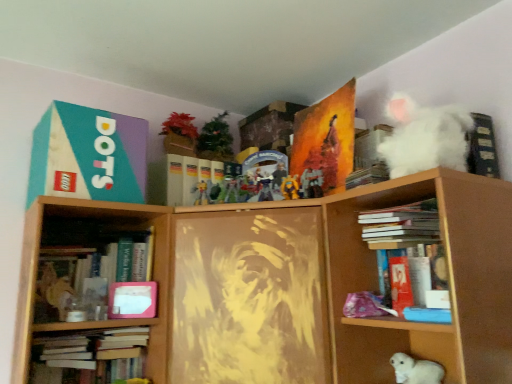
How much space does orange matte painting at upper center, acting as the second paperback book starting from the left, occupy horizontally?

8.38 centimeters.

The image size is (512, 384). Describe the element at coordinates (202, 194) in the screenshot. I see `matte plastic action figure at center, arranged as the 3th toy when viewed from the top` at that location.

This screenshot has width=512, height=384. What do you see at coordinates (90, 354) in the screenshot?
I see `hardcover book at lower left, which appears as the 1th book when viewed from the left` at bounding box center [90, 354].

In order to face shiny plastic action figure at center, the second toy positioned from the back, should I rotate leftwards or rightwards?

Rotate your view left by about 2.793°.

Where is `white fluffy cat at lower right, which ranks as the fourth toy in left-to-right order`? The height and width of the screenshot is (384, 512). white fluffy cat at lower right, which ranks as the fourth toy in left-to-right order is located at coordinates (416, 370).

Image resolution: width=512 pixels, height=384 pixels. Find the location of `orange matte painting at upper center, acting as the second paperback book starting from the left`. orange matte painting at upper center, acting as the second paperback book starting from the left is located at coordinates (326, 131).

Considering the sizes of hardcover book at lower left, which appears as the 1th book when viewed from the left, and white matte book at center in the image, is hardcover book at lower left, which appears as the 1th book when viewed from the left, wider or thinner than white matte book at center?

In the image, hardcover book at lower left, which appears as the 1th book when viewed from the left, appears to be wider than white matte book at center.

This screenshot has height=384, width=512. In the image, there is a white matte book at center. Identify the location of book below it (from a real-world perspective). (90, 354).

Which point is more forward, (138, 329) or (129, 317)?

Point (129, 317)

How different are the orientations of hardcover book at lower left, positioned as the 5th book in right-to-left order, and white matte book at center in degrees?

They differ by 38.9 degrees in their facing directions.

Is shiny plastic action figure at center, the second toy positioned from the back, oriented towards yellow matte toy at center, the 2th toy positioned from the front?

No, shiny plastic action figure at center, the second toy positioned from the back, is not oriented towards yellow matte toy at center, the 2th toy positioned from the front.

In terms of width, does shiny plastic action figure at center, the third toy from the right, look wider or thinner when compared to yellow matte toy at center, placed as the 2th toy when sorted from right to left?

In the image, shiny plastic action figure at center, the third toy from the right, appears to be wider than yellow matte toy at center, placed as the 2th toy when sorted from right to left.

Where is `the 1st toy directly beneath the yellow matte toy at center, placed as the 2th toy when sorted from right to left (from a real-world perspective)`? The height and width of the screenshot is (384, 512). the 1st toy directly beneath the yellow matte toy at center, placed as the 2th toy when sorted from right to left (from a real-world perspective) is located at coordinates (231, 191).

Which is behind, shiny plastic action figure at center, the second toy from the top, or yellow matte toy at center, placed as the 2th toy when sorted from right to left?

shiny plastic action figure at center, the second toy from the top, is further from the camera.

Can we say white matte book at upper right, which is the third book from bottom to top, lies outside yellow matte toy at center, placed as the 2th toy when sorted from right to left?

Absolutely, white matte book at upper right, which is the third book from bottom to top, is external to yellow matte toy at center, placed as the 2th toy when sorted from right to left.

Can you confirm if white matte book at upper right, acting as the 5th book starting from the left, is taller than yellow matte toy at center, marked as the third toy in a left-to-right arrangement?

Correct, white matte book at upper right, acting as the 5th book starting from the left, is much taller as yellow matte toy at center, marked as the third toy in a left-to-right arrangement.

From the picture: Is white matte book at upper right, which is the third book from bottom to top, bigger or smaller than yellow matte toy at center, which ranks as the fourth toy in bottom-to-top order?

In the image, white matte book at upper right, which is the third book from bottom to top, appears to be larger than yellow matte toy at center, which ranks as the fourth toy in bottom-to-top order.

Considering the sizes of objects hardcover book at upper center, acting as the fifth book starting from the bottom, and hardcover book at center, the fourth book in the bottom-to-top sequence, in the image provided, who is shorter, hardcover book at upper center, acting as the fifth book starting from the bottom, or hardcover book at center, the fourth book in the bottom-to-top sequence,?

hardcover book at upper center, acting as the fifth book starting from the bottom, is shorter.

Image resolution: width=512 pixels, height=384 pixels. What are the coordinates of `the 3rd book in front of the hardcover book at center, arranged as the third book when viewed from the left, counting from the anchor's position` in the screenshot? It's located at (368, 175).

Considering the relative positions of hardcover book at upper center, the 1th book from the top, and hardcover book at center, the fourth book in the bottom-to-top sequence, in the image provided, is hardcover book at upper center, the 1th book from the top, to the left or to the right of hardcover book at center, the fourth book in the bottom-to-top sequence,?

Clearly, hardcover book at upper center, the 1th book from the top, is on the right of hardcover book at center, the fourth book in the bottom-to-top sequence, in the image.

How different are the orientations of hardcover book at upper center, acting as the fifth book starting from the bottom, and hardcover book at center, the 2th book from the top, in degrees?

The angular difference between hardcover book at upper center, acting as the fifth book starting from the bottom, and hardcover book at center, the 2th book from the top, is 111 degrees.

From the image's perspective, is yellow matte toy at center, marked as the third toy in a left-to-right arrangement, above or below teal matte paper at upper left, which is counted as the first paperback book, starting from the left?

Based on their image positions, yellow matte toy at center, marked as the third toy in a left-to-right arrangement, is located beneath teal matte paper at upper left, which is counted as the first paperback book, starting from the left.

Does yellow matte toy at center, the 2th toy positioned from the front, have a lesser height compared to teal matte paper at upper left, which is counted as the 2th paperback book, starting from the right?

Indeed, yellow matte toy at center, the 2th toy positioned from the front, has a lesser height compared to teal matte paper at upper left, which is counted as the 2th paperback book, starting from the right.

Is point (283, 188) closer or farther from the camera than point (35, 149)?

Point (283, 188) is farther from the camera than point (35, 149).

Starting from the teal matte paper at upper left, which is counted as the 2th paperback book, starting from the right, which toy is the 1st one behind? Please provide its 2D coordinates.

[(290, 187)]

From the image's perspective, would you say teal matte paper at upper left, which is counted as the 2th paperback book, starting from the right, is positioned over matte plastic action figure at center, the 4th toy viewed from the right?

Indeed, from the image's perspective, teal matte paper at upper left, which is counted as the 2th paperback book, starting from the right, is shown above matte plastic action figure at center, the 4th toy viewed from the right.

Which point is more forward, (76,131) or (198,185)?

The point (76,131) is closer to the camera.

Relative to matte plastic action figure at center, the 4th toy from the front, is teal matte paper at upper left, which is counted as the first paperback book, starting from the left, in front or behind?

teal matte paper at upper left, which is counted as the first paperback book, starting from the left, is positioned closer to the viewer than matte plastic action figure at center, the 4th toy from the front.

From a real-world perspective, is teal matte paper at upper left, which is counted as the 2th paperback book, starting from the right, on top of matte plastic action figure at center, arranged as the 3th toy when viewed from the top?

Yes, from a real-world perspective, teal matte paper at upper left, which is counted as the 2th paperback book, starting from the right, is above matte plastic action figure at center, arranged as the 3th toy when viewed from the top.

Where is `toy that is the 2nd object above the white fluffy cat at lower right, the fourth toy viewed from the top (from a real-world perspective)`? Image resolution: width=512 pixels, height=384 pixels. toy that is the 2nd object above the white fluffy cat at lower right, the fourth toy viewed from the top (from a real-world perspective) is located at coordinates (290, 187).

Could you tell me if white fluffy cat at lower right, the 1th toy when ordered from front to back, is turned towards yellow matte toy at center, which ranks as the fourth toy in bottom-to-top order?

No, white fluffy cat at lower right, the 1th toy when ordered from front to back, is not turned towards yellow matte toy at center, which ranks as the fourth toy in bottom-to-top order.

Would you say white fluffy cat at lower right, which ranks as the fourth toy in left-to-right order, is to the left or to the right of yellow matte toy at center, acting as the first toy starting from the top, in the picture?

In the image, white fluffy cat at lower right, which ranks as the fourth toy in left-to-right order, appears on the right side of yellow matte toy at center, acting as the first toy starting from the top.

From the image's perspective, is white fluffy cat at lower right, which ranks as the fourth toy in left-to-right order, located beneath yellow matte toy at center, which appears as the 3th toy when viewed from the back?

Result: Yes, from the image's perspective, white fluffy cat at lower right, which ranks as the fourth toy in left-to-right order, is below yellow matte toy at center, which appears as the 3th toy when viewed from the back.

Where is `book cover that appears above the hardcover book at lower left, positioned as the 5th book in top-to-bottom order (from the image's perspective)`? The height and width of the screenshot is (384, 512). book cover that appears above the hardcover book at lower left, positioned as the 5th book in top-to-bottom order (from the image's perspective) is located at coordinates (132, 300).

From the image's perspective, count 1st toys downward from the yellow matte toy at center, acting as the first toy starting from the top, and point to it. Please provide its 2D coordinates.

[(231, 191)]

Considering their positions, is hardcover book at lower left, which appears as the 1th book when viewed from the left, positioned closer to hardcover book at upper center, the 1th book from the top, than matte plastic action figure at center, arranged as the 3th toy when viewed from the top?

matte plastic action figure at center, arranged as the 3th toy when viewed from the top, is positioned closer to the anchor hardcover book at upper center, the 1th book from the top.

Which object lies nearer to the anchor point hardcover book at left, the second book when ordered from left to right, shiny plastic action figure at center, the second toy positioned from the back, or matte plastic action figure at center, which ranks as the first toy in back-to-front order?

Based on the image, matte plastic action figure at center, which ranks as the first toy in back-to-front order, appears to be nearer to hardcover book at left, the second book when ordered from left to right.

Looking at this image, looking at the image, which one is located further to hardcover book at center, the fourth book in the bottom-to-top sequence, white matte book at upper right, arranged as the 1th book when viewed from the right, or hardcover book at upper center, acting as the fifth book starting from the bottom?

Based on the image, white matte book at upper right, arranged as the 1th book when viewed from the right, appears to be further to hardcover book at center, the fourth book in the bottom-to-top sequence.

Considering their positions, is hardcover book at center, marked as the 3th book in a right-to-left arrangement, positioned closer to teal matte paper at upper left, which is counted as the 2th paperback book, starting from the right, than hardcover book at upper center, which appears as the 2th book when viewed from the right?

hardcover book at center, marked as the 3th book in a right-to-left arrangement.

Considering their positions, is orange matte painting at upper center, which is the first paperback book from right to left, positioned further to white fluffy cat at lower right, which ranks as the fourth toy in left-to-right order, than white matte book at center?

white matte book at center lies further to white fluffy cat at lower right, which ranks as the fourth toy in left-to-right order, than the other object.

Looking at the image, which one is located closer to hardcover book at upper center, acting as the fifth book starting from the bottom, matte plastic action figure at center, the 4th toy from the front, or hardcover book at lower left, positioned as the 5th book in top-to-bottom order?

Based on the image, matte plastic action figure at center, the 4th toy from the front, appears to be nearer to hardcover book at upper center, acting as the fifth book starting from the bottom.

Looking at the image, which one is located further to white matte book at center, hardcover book at lower left, positioned as the 5th book in top-to-bottom order, or white fluffy cat at lower right, the 1th toy when ordered from front to back?

white fluffy cat at lower right, the 1th toy when ordered from front to back, is positioned further to the anchor white matte book at center.

Considering their positions, is yellow matte toy at center, placed as the 2th toy when sorted from right to left, positioned closer to white matte book at upper right, arranged as the 1th book when viewed from the right, than white fluffy cat at lower right, the 1th toy when ordered from front to back?

yellow matte toy at center, placed as the 2th toy when sorted from right to left.

The width and height of the screenshot is (512, 384). Identify the location of book cover located between hardcover book at left, which ranks as the 4th book in right-to-left order, and hardcover book at upper center, acting as the fifth book starting from the bottom, in the left-right direction. (132, 300).

Find the location of a particular element. Image resolution: width=512 pixels, height=384 pixels. book cover between hardcover book at lower left, positioned as the 5th book in right-to-left order, and white matte book at upper right, which is the third book from bottom to top is located at coordinates [x=132, y=300].

You are a GUI agent. You are given a task and a screenshot of the screen. Output one action in this format:
    pyautogui.click(x=<x>, y=<y>)
    Task: Click on the book between hardcover book at left, the 2th book ordered from the bottom, and yellow matte toy at center, the 2th toy positioned from the front, from left to right
    
    Given the screenshot: What is the action you would take?
    pyautogui.click(x=199, y=182)

I want to click on book cover between hardcover book at center, arranged as the third book when viewed from the left, and hardcover book at lower left, which appears as the 1th book when viewed from the left, from top to bottom, so click(x=132, y=300).